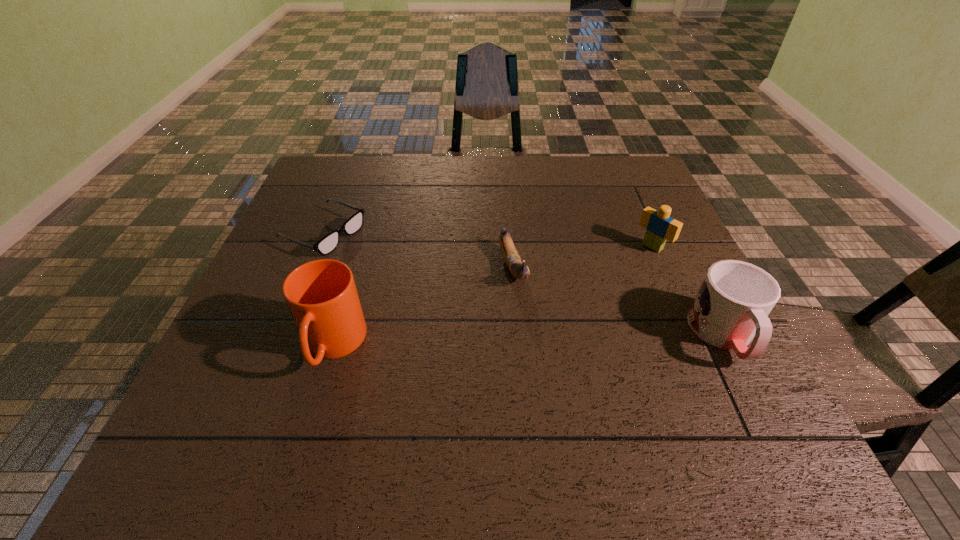
You are a GUI agent. You are given a task and a screenshot of the screen. Output one action in this format:
    pyautogui.click(x=<x>, y=<y>)
    Task: Click on the free space located 0.090m at the stem of the second shortest object
    
    Given the screenshot: What is the action you would take?
    pyautogui.click(x=531, y=323)

This screenshot has height=540, width=960. In order to click on vacant space situated 0.290m at the stem of the second shortest object in this screenshot , I will do `click(564, 404)`.

Locate an element on the screen. vacant space located at the stem of the second shortest object is located at coordinates (546, 360).

The height and width of the screenshot is (540, 960). I want to click on vacant space positioned 0.110m on the front-facing side of the shortest object, so click(389, 261).

You are a GUI agent. You are given a task and a screenshot of the screen. Output one action in this format:
    pyautogui.click(x=<x>, y=<y>)
    Task: Click on the free location located 0.360m on the front-facing side of the shortest object
    The width and height of the screenshot is (960, 540).
    Given the screenshot: What is the action you would take?
    pyautogui.click(x=476, y=298)

At what (x,y) coordinates should I click in order to perform the action: click on free spot located 0.310m on the front-facing side of the shortest object. Please return your answer as a coordinate pair (x, y). Looking at the image, I should click on (457, 290).

I want to click on mug that is at the left edge, so click(322, 297).

The width and height of the screenshot is (960, 540). I want to click on spectacles present at the left edge, so click(328, 243).

Identify the location of mug at the right edge. This screenshot has height=540, width=960. (731, 308).

Find the location of a particular element. Image resolution: width=960 pixels, height=540 pixels. Lego that is at the right edge is located at coordinates (660, 227).